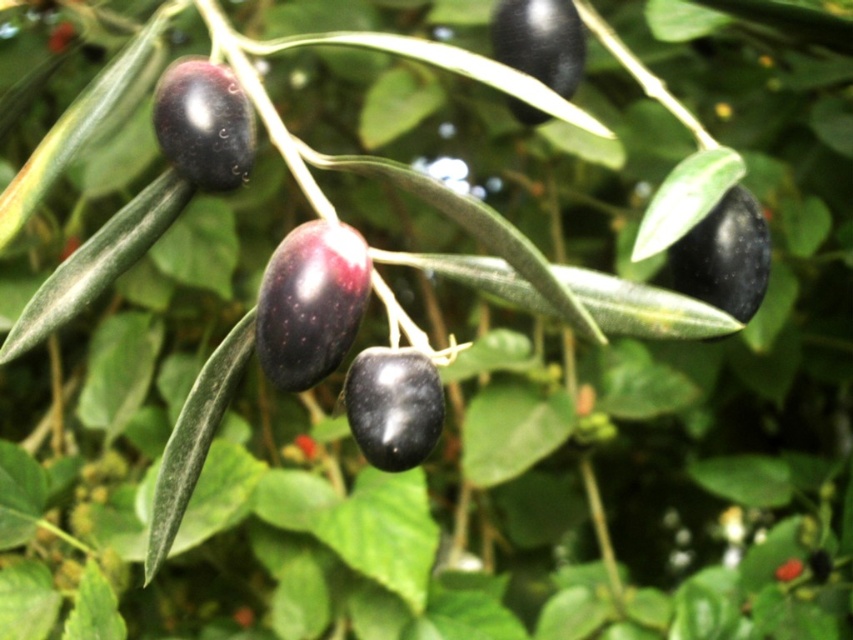
Does shiny dark olive at upper left appear on the left side of shiny black olive at center-right?

Correct, you'll find shiny dark olive at upper left to the left of shiny black olive at center-right.

Which is above, shiny dark olive at upper left or shiny black olive at center-right?

Positioned higher is shiny dark olive at upper left.

The width and height of the screenshot is (853, 640). In order to click on shiny dark olive at upper left in this screenshot , I will do `click(204, 124)`.

Where is `shiny dark olive at upper left`? shiny dark olive at upper left is located at coordinates (204, 124).

Is point (329, 275) behind point (344, 385)?

No.

Does point (311, 371) lie in front of point (344, 392)?

Yes, point (311, 371) is in front of point (344, 392).

At what (x,y) coordinates should I click in order to perform the action: click on shiny dark olive at center. Please return your answer as a coordinate pair (x, y). Looking at the image, I should click on (310, 301).

Does point (744, 276) lie behind point (566, 88)?

No, it is not.

Locate an element on the screen. This screenshot has width=853, height=640. shiny black olive at center-right is located at coordinates (724, 257).

Does point (691, 259) come in front of point (540, 8)?

Yes, point (691, 259) is in front of point (540, 8).

The width and height of the screenshot is (853, 640). I want to click on shiny black olive at center-right, so click(x=724, y=257).